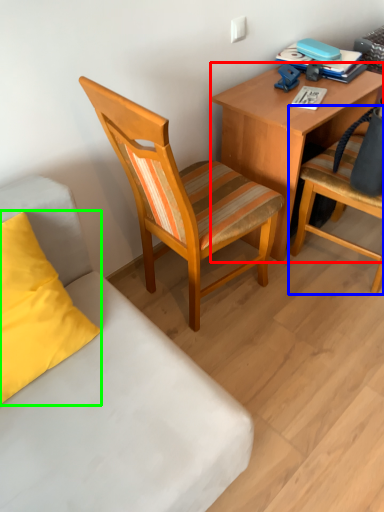
Question: Which is nearer to the desk (highlighted by a red box)? chair (highlighted by a blue box) or pillow (highlighted by a green box).

Choices:
 (A) chair
 (B) pillow

Answer: (A)